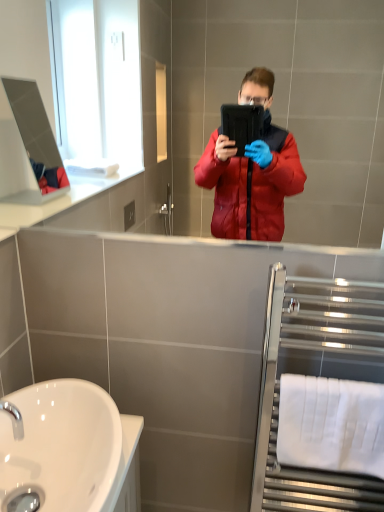
Question: From the image's perspective, would you say white fabric towel bar at lower right is shown under white glossy sink at lower left?

Choices:
 (A) no
 (B) yes

Answer: (B)

Question: Is white fabric towel bar at lower right facing away from white glossy sink at lower left?

Choices:
 (A) yes
 (B) no

Answer: (B)

Question: Considering the relative sizes of white fabric towel bar at lower right and white glossy sink at lower left in the image provided, is white fabric towel bar at lower right wider than white glossy sink at lower left?

Choices:
 (A) no
 (B) yes

Answer: (A)

Question: Is the surface of white fabric towel bar at lower right in direct contact with white glossy sink at lower left?

Choices:
 (A) no
 (B) yes

Answer: (A)

Question: Is white fabric towel bar at lower right positioned beyond the bounds of white glossy sink at lower left?

Choices:
 (A) no
 (B) yes

Answer: (B)

Question: Considering the positions of polished chrome towel rack at right and white fabric towel bar at lower right in the image, is polished chrome towel rack at right taller or shorter than white fabric towel bar at lower right?

Choices:
 (A) tall
 (B) short

Answer: (A)

Question: Is polished chrome towel rack at right spatially inside white fabric towel bar at lower right, or outside of it?

Choices:
 (A) inside
 (B) outside

Answer: (B)

Question: In the image, is polished chrome towel rack at right positioned in front of or behind white fabric towel bar at lower right?

Choices:
 (A) behind
 (B) front

Answer: (B)

Question: From the image's perspective, is polished chrome towel rack at right located above or below white fabric towel bar at lower right?

Choices:
 (A) below
 (B) above

Answer: (B)

Question: Considering the positions of white fabric towel bar at lower right and polished chrome towel rack at right in the image, is white fabric towel bar at lower right wider or thinner than polished chrome towel rack at right?

Choices:
 (A) thin
 (B) wide

Answer: (A)

Question: Is point (327, 440) positioned closer to the camera than point (268, 343)?

Choices:
 (A) closer
 (B) farther

Answer: (A)

Question: From the image's perspective, is white fabric towel bar at lower right above or below polished chrome towel rack at right?

Choices:
 (A) below
 (B) above

Answer: (A)

Question: Visually, is white fabric towel bar at lower right positioned to the left or to the right of polished chrome towel rack at right?

Choices:
 (A) right
 (B) left

Answer: (B)

Question: Is white glossy sink at lower left in front of or behind chrome metallic tap at lower left in the image?

Choices:
 (A) front
 (B) behind

Answer: (A)

Question: Looking at the image, does white glossy sink at lower left seem bigger or smaller compared to chrome metallic tap at lower left?

Choices:
 (A) small
 (B) big

Answer: (B)